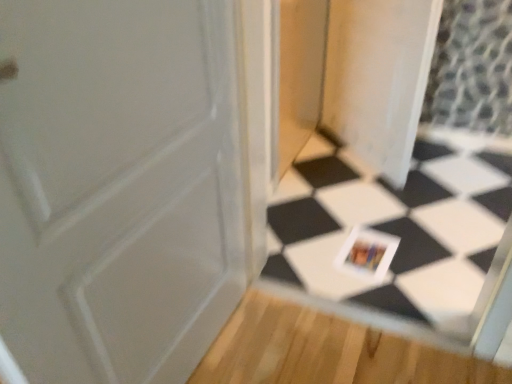
Question: Considering the relative positions of transparent plastic screen door at center and white glossy postcard at center in the image provided, is transparent plastic screen door at center to the left or to the right of white glossy postcard at center?

Choices:
 (A) right
 (B) left

Answer: (A)

Question: Considering the positions of transparent plastic screen door at center and white glossy postcard at center in the image, is transparent plastic screen door at center bigger or smaller than white glossy postcard at center?

Choices:
 (A) small
 (B) big

Answer: (B)

Question: Which object is positioned closest to the white glossy postcard at center?

Choices:
 (A) white glossy tile at center
 (B) transparent plastic screen door at center

Answer: (A)

Question: Which is nearer to the transparent plastic screen door at center?

Choices:
 (A) white glossy postcard at center
 (B) white glossy tile at center

Answer: (B)